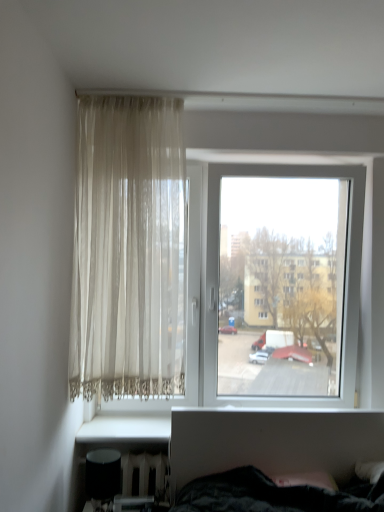
Question: Considering the relative positions of sheer beige curtain at upper left and transparent glass window at center in the image provided, is sheer beige curtain at upper left to the left or to the right of transparent glass window at center?

Choices:
 (A) left
 (B) right

Answer: (A)

Question: Choose the correct answer: Is sheer beige curtain at upper left inside transparent glass window at center or outside it?

Choices:
 (A) outside
 (B) inside

Answer: (A)

Question: Relative to transparent glass window at center, is sheer beige curtain at upper left in front or behind?

Choices:
 (A) behind
 (B) front

Answer: (B)

Question: From the image's perspective, is transparent glass window at center located above or below sheer beige curtain at upper left?

Choices:
 (A) below
 (B) above

Answer: (A)

Question: Does point [x=112, y=280] appear closer or farther from the camera than point [x=162, y=269]?

Choices:
 (A) farther
 (B) closer

Answer: (B)

Question: In the image, is transparent glass window at center positioned in front of or behind sheer beige curtain at upper left?

Choices:
 (A) front
 (B) behind

Answer: (B)

Question: From a real-world perspective, relative to sheer beige curtain at upper left, is transparent glass window at center vertically above or below?

Choices:
 (A) above
 (B) below

Answer: (B)